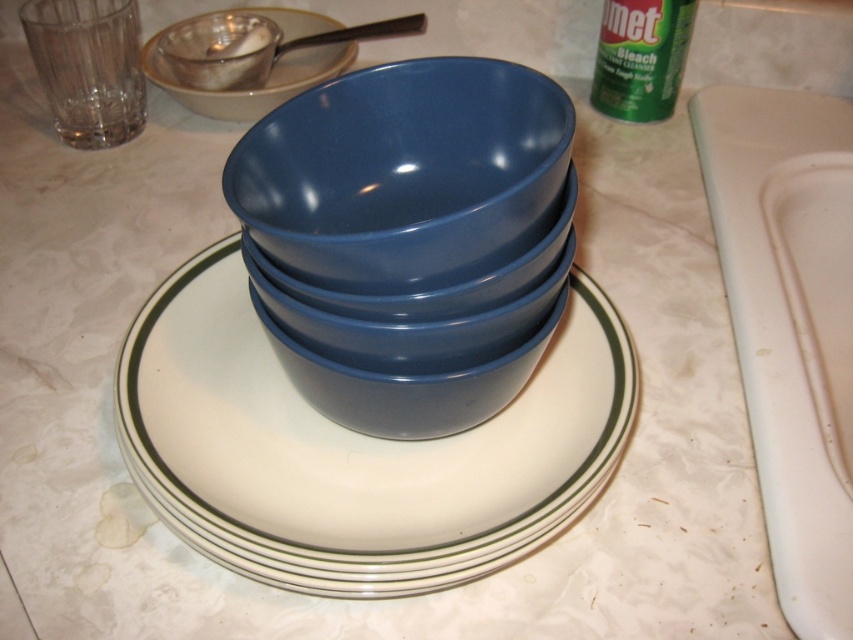
From the picture: You are organizing dishes in the kitchen and need to place the matte blue bowl at center and the matte ceramic saucer at upper left into a cabinet. The cabinet shelf you want to use has a height limit of 10 cm. Can both items fit vertically on the shelf without exceeding the height limit?

The matte blue bowl at center is not as tall as the matte ceramic saucer at upper left. Since the ceramic saucer is taller, but the exact height isn not provided, we can assume that if the saucer is under 10 cm, both can fit. However, without specific measurements, it is uncertain. Please check the actual heights.

You are organizing dishes in a kitchen and need to place the matte blue bowl at center and the white glossy platter at center on a shelf. The shelf has limited depth. Which object should you place closer to the front of the shelf to ensure both fit without overlapping?

The matte blue bowl at center is behind the white glossy platter at center, so to fit both on the shelf without overlapping, place the white glossy platter at center closer to the front.

You are organizing a dinner party and need to place a decorative centerpiece on the white glossy platter at center. However, you also have a matte blue bowl at center that you want to use. Can both items fit on the platter if placed together?

The white glossy platter at center is larger in size than the matte blue bowl at center, so yes, both items can fit on the platter if placed together.